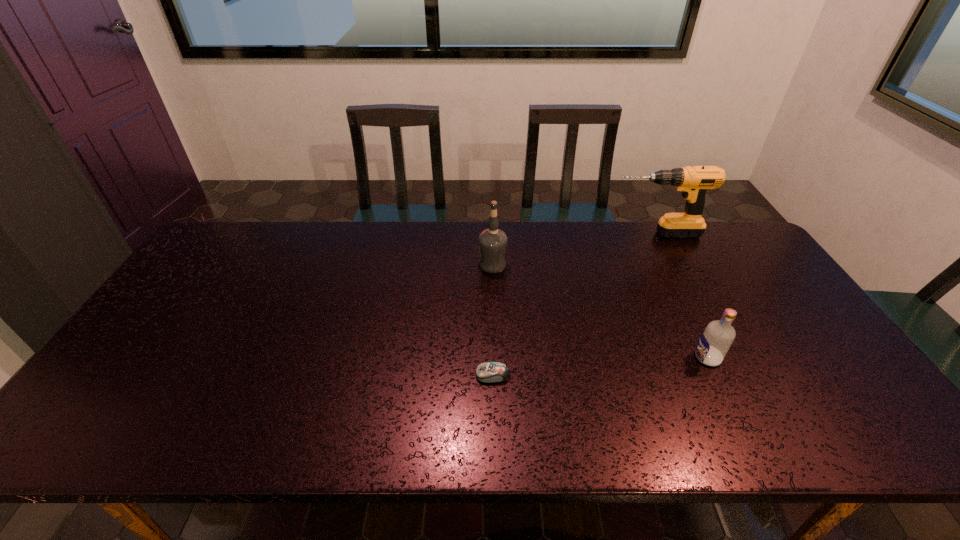
This screenshot has width=960, height=540. I want to click on free space located on the front label of the taller vodka, so (388, 264).

At what (x,y) coordinates should I click in order to perform the action: click on free spot located on the front label of the taller vodka. Please return your answer as a coordinate pair (x, y). Looking at the image, I should click on (463, 264).

This screenshot has height=540, width=960. Find the location of `vacant region located on the label of the right vodka`. vacant region located on the label of the right vodka is located at coordinates (643, 357).

This screenshot has height=540, width=960. Identify the location of free spot located on the label of the right vodka. (573, 357).

Find the location of `free region located on the label of the right vodka`. free region located on the label of the right vodka is located at coordinates (589, 357).

What are the coordinates of `vacant position located 0.330m on the wheel side of the computer mouse` in the screenshot? It's located at (342, 375).

The image size is (960, 540). In order to click on vacant area situated on the wheel side of the computer mouse in this screenshot , I will do `click(435, 375)`.

I want to click on vacant region located on the wheel side of the computer mouse, so click(x=322, y=375).

Where is `drill situated at the far edge`? This screenshot has height=540, width=960. drill situated at the far edge is located at coordinates (694, 181).

Image resolution: width=960 pixels, height=540 pixels. Find the location of `vodka located at the far edge`. vodka located at the far edge is located at coordinates click(x=492, y=242).